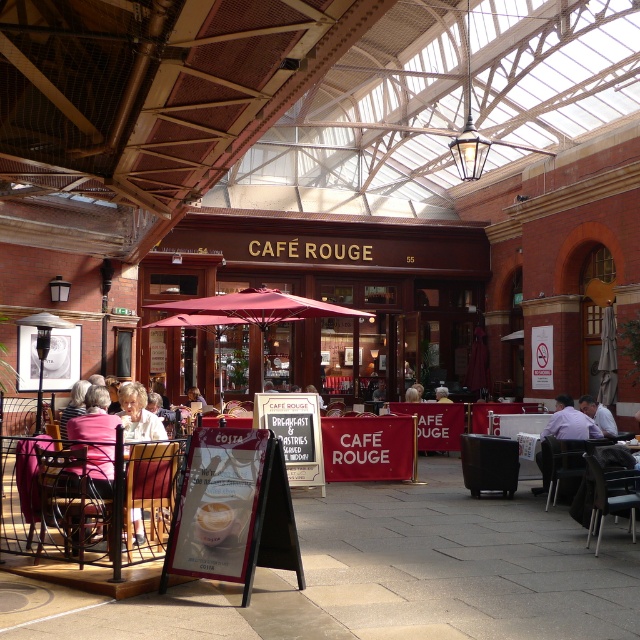
Question: Is metallic wire chair at center to the right of metallic silver chair at lower right from the viewer's perspective?

Choices:
 (A) no
 (B) yes

Answer: (A)

Question: Which point is closer to the camera?

Choices:
 (A) yellow fabric shirt at center
 (B) red fabric umbrella at center
 (C) white fabric umbrella at center
 (D) metallic wire chair at center

Answer: (D)

Question: Where is pink fabric jacket at lower left located in relation to light purple shirt at right in the image?

Choices:
 (A) above
 (B) below

Answer: (A)

Question: Can you confirm if matte black chair at center is positioned to the right of light purple shirt at right?

Choices:
 (A) no
 (B) yes

Answer: (A)

Question: Which of the following is the farthest from the observer?

Choices:
 (A) yellow fabric shirt at center
 (B) light purple shirt at right
 (C) metallic silver chair at center

Answer: (A)

Question: Which point appears farthest from the camera in this image?

Choices:
 (A) (84, 508)
 (B) (100, 461)
 (C) (545, 442)
 (D) (173, 502)

Answer: (C)